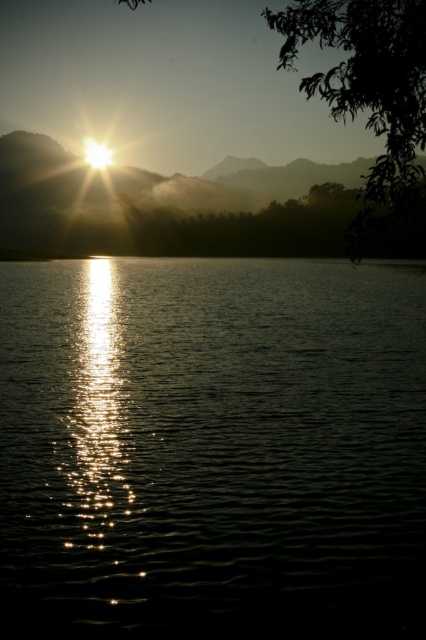
Question: Can you confirm if glistening liquid at center is thinner than green leafy tree at upper right?

Choices:
 (A) yes
 (B) no

Answer: (A)

Question: Can you confirm if glistening liquid at center is wider than green leafy tree at upper right?

Choices:
 (A) yes
 (B) no

Answer: (B)

Question: Which object appears farthest from the camera in this image?

Choices:
 (A) green leafy tree at upper right
 (B) glistening liquid at center

Answer: (A)

Question: Which point is farther to the camera?

Choices:
 (A) (367, 202)
 (B) (77, 634)

Answer: (A)

Question: Is glistening liquid at center positioned at the back of green leafy tree at upper right?

Choices:
 (A) yes
 (B) no

Answer: (B)